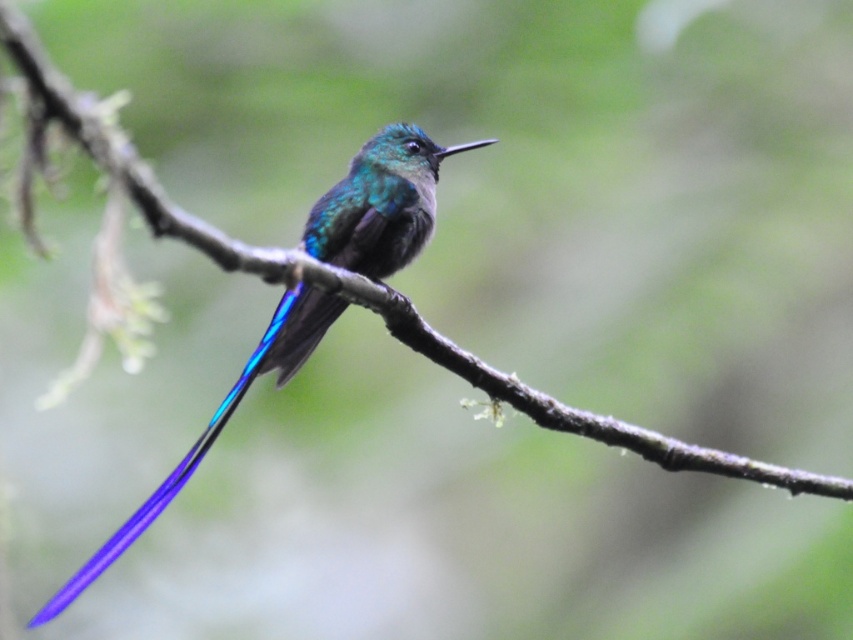
Question: Does metallic iridescent hummingbird at center have a greater width compared to glossy blue tail at center?

Choices:
 (A) yes
 (B) no

Answer: (A)

Question: Among these objects, which one is farthest from the camera?

Choices:
 (A) metallic iridescent hummingbird at center
 (B) glossy blue tail at center

Answer: (A)

Question: Is metallic iridescent hummingbird at center in front of glossy blue tail at center?

Choices:
 (A) no
 (B) yes

Answer: (A)

Question: Is metallic iridescent hummingbird at center further to camera compared to glossy blue tail at center?

Choices:
 (A) no
 (B) yes

Answer: (B)

Question: Which of the following is the farthest from the observer?

Choices:
 (A) (x=252, y=372)
 (B) (x=357, y=154)

Answer: (B)

Question: Which object appears farthest from the camera in this image?

Choices:
 (A) glossy blue tail at center
 (B) metallic iridescent hummingbird at center

Answer: (B)